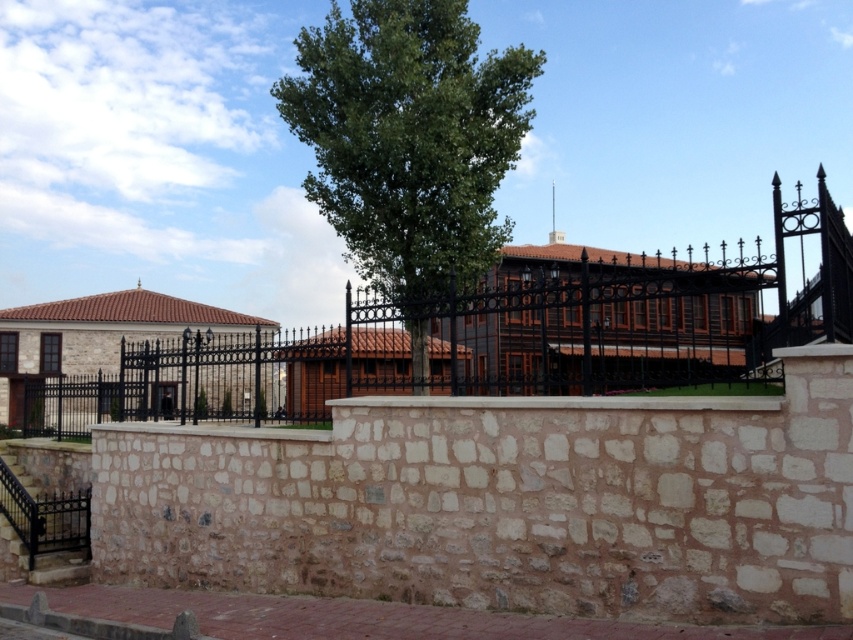
Does black wrought iron fence at center have a lesser width compared to green leafy tree at center?

No.

Between black wrought iron fence at center and green leafy tree at center, which one has less height?

With less height is black wrought iron fence at center.

Measure the distance between black wrought iron fence at center and camera.

black wrought iron fence at center is 6.06 meters from camera.

Where is `black wrought iron fence at center`? This screenshot has width=853, height=640. black wrought iron fence at center is located at coordinates (490, 339).